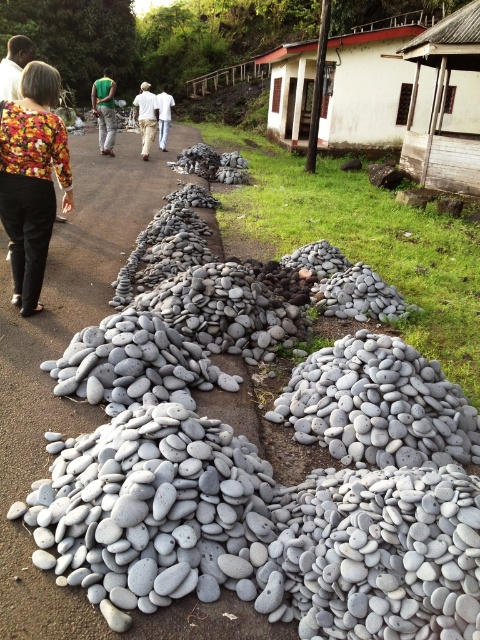
You are a person standing at the edge of the path, and you see a green jersey at center and a khaki pants at center. If you want to pick up both items, which one would you reach first assuming you walk straight towards the center?

The green jersey at center and khaki pants at center are both at the center, so you would reach them at the same time since they are equidistant from your starting position.